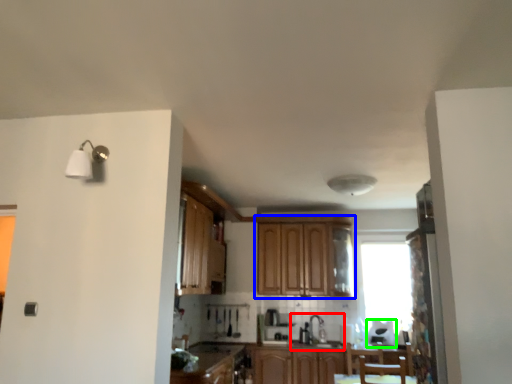
Question: Which is nearer to the sink (highlighted by a red box)? cabinetry (highlighted by a blue box) or appliance (highlighted by a green box).

Choices:
 (A) cabinetry
 (B) appliance

Answer: (B)